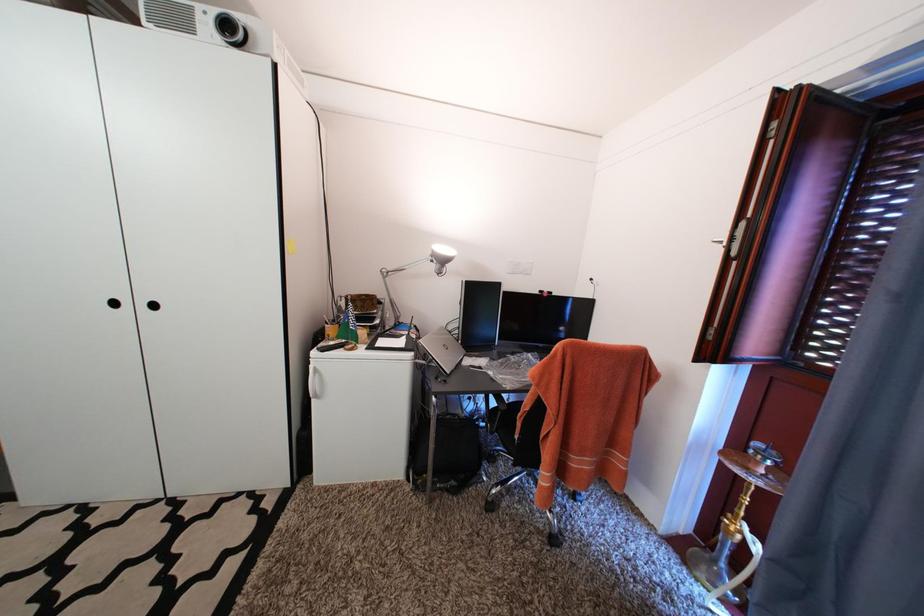
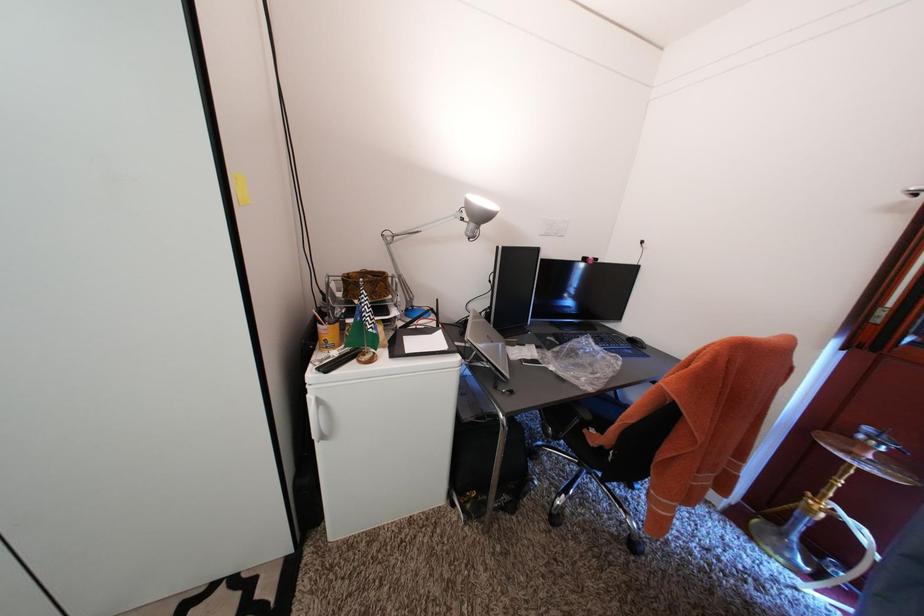
What movement of the cameraman would produce the second image?

The cameraman moved toward left, forward.